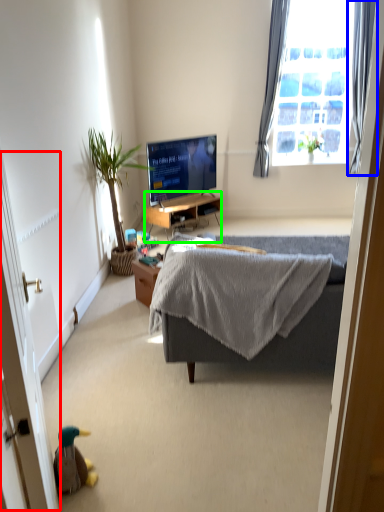
Question: Which object is positioned closest to screen door (highlighted by a red box)? Select from curtain (highlighted by a blue box) and desk (highlighted by a green box).

Choices:
 (A) curtain
 (B) desk

Answer: (B)